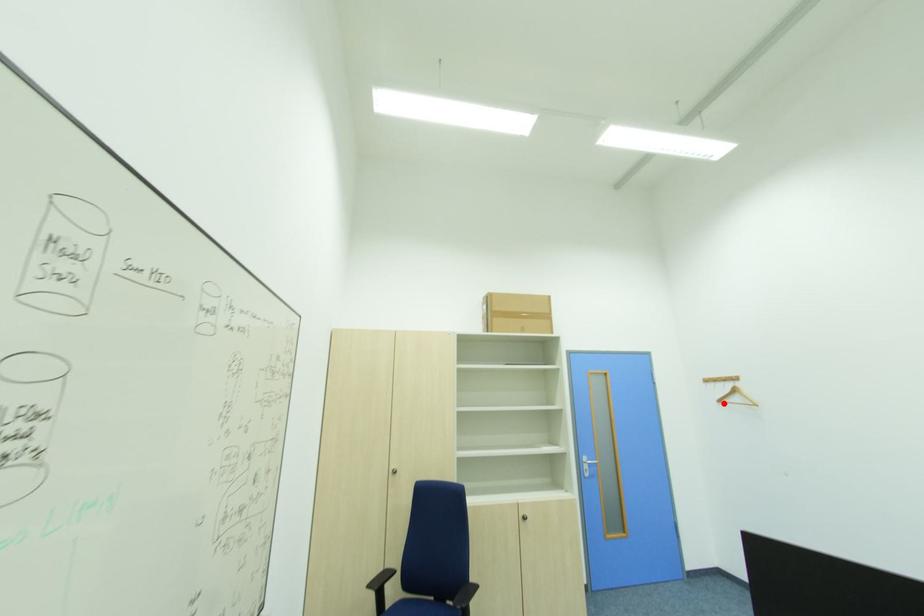
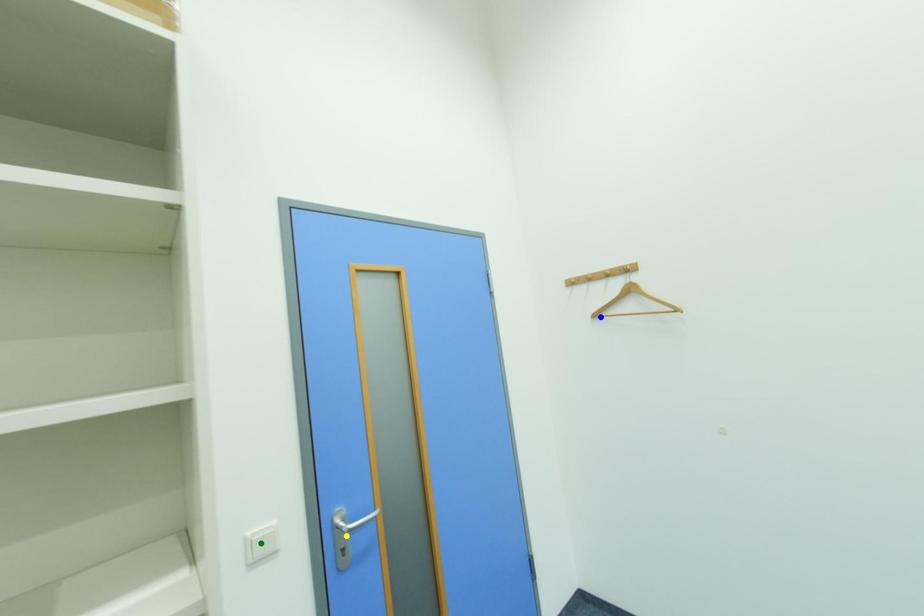
Question: I am providing you with two images of the same scene from different viewpoints. A red point is marked on the first image. You are given multiple points on the second image. Which point in image 2 is actually the same real-world point as the red point in image 1?

Choices:
 (A) yellow point
 (B) blue point
 (C) green point

Answer: (B)